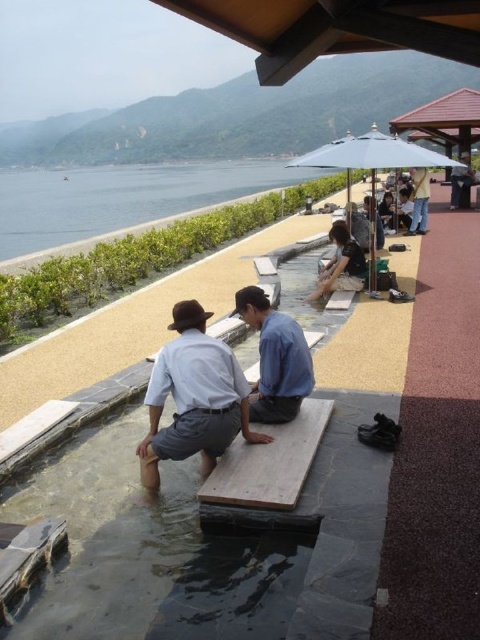
You are planning to set up a small tent for a picnic in this area. Considering the clear water at lower left and the light brown wooden bench at upper right, which location would be more suitable for placing the tent? Please explain your reasoning based on the available space.

The clear water at lower left has a larger size compared to the light brown wooden bench at upper right. Therefore, the area around the clear water at lower left offers more space to set up the tent, making it a more suitable location for the picnic.

You are planning to place a 10 feet long bench between the light blue shirt at center and the light brown wooden bench at upper right. Is there enough space between them for this bench?

The distance between the light blue shirt at center and the light brown wooden bench at upper right is 48.32 feet, so yes, there is enough space to place a 10 feet long bench between them.

You are planning to set up a picnic area in the image and need to choose between the matte blue umbrella at upper right and the light blue fabric umbrella at upper center for shade. Which umbrella should you choose if you want more vertical space underneath?

The matte blue umbrella at upper right has a greater height compared to the light blue fabric umbrella at upper center, so it provides more vertical space underneath.